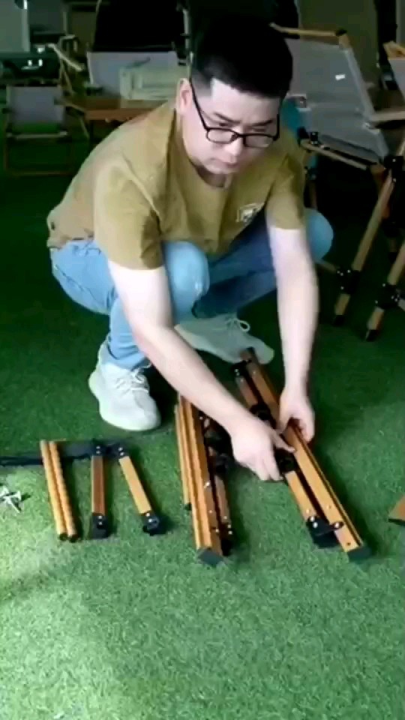
Find the location of a particular element. The image size is (405, 720). wooden desk is located at coordinates (99, 112).